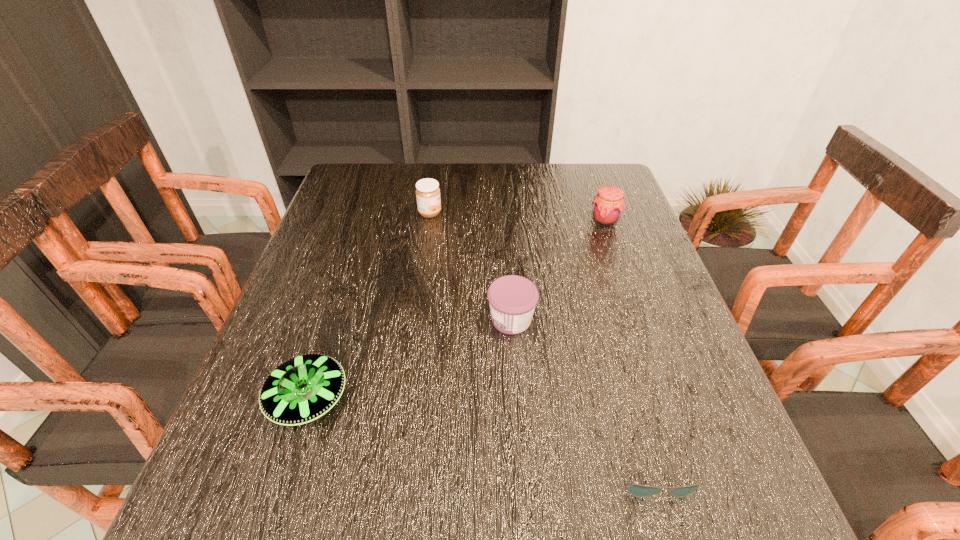
The image size is (960, 540). Find the location of `vacant space situated 0.210m on the front label of the third object from right to left`. vacant space situated 0.210m on the front label of the third object from right to left is located at coordinates (387, 320).

Locate an element on the screen. This screenshot has height=540, width=960. free location located 0.160m on the front label of the third object from right to left is located at coordinates (411, 320).

Image resolution: width=960 pixels, height=540 pixels. Identify the location of blank space located on the right of the saucer. (393, 399).

Find the location of a particular element. object at the near edge is located at coordinates (640, 491).

The height and width of the screenshot is (540, 960). In order to click on object situated at the left edge in this screenshot , I will do `click(302, 389)`.

Where is `jam that is at the right edge`? The width and height of the screenshot is (960, 540). jam that is at the right edge is located at coordinates (608, 204).

You are a GUI agent. You are given a task and a screenshot of the screen. Output one action in this format:
    pyautogui.click(x=<x>, y=<y>)
    Task: Click on the sunglasses present at the right edge
    
    Given the screenshot: What is the action you would take?
    pyautogui.click(x=640, y=491)

You are a GUI agent. You are given a task and a screenshot of the screen. Output one action in this format:
    pyautogui.click(x=<x>, y=<y>)
    Task: Click on the object that is at the near right corner
    The width and height of the screenshot is (960, 540).
    Given the screenshot: What is the action you would take?
    pyautogui.click(x=640, y=491)

I want to click on vacant space at the far edge of the desktop, so click(x=541, y=190).

Identify the location of vacant area at the near edge. (582, 523).